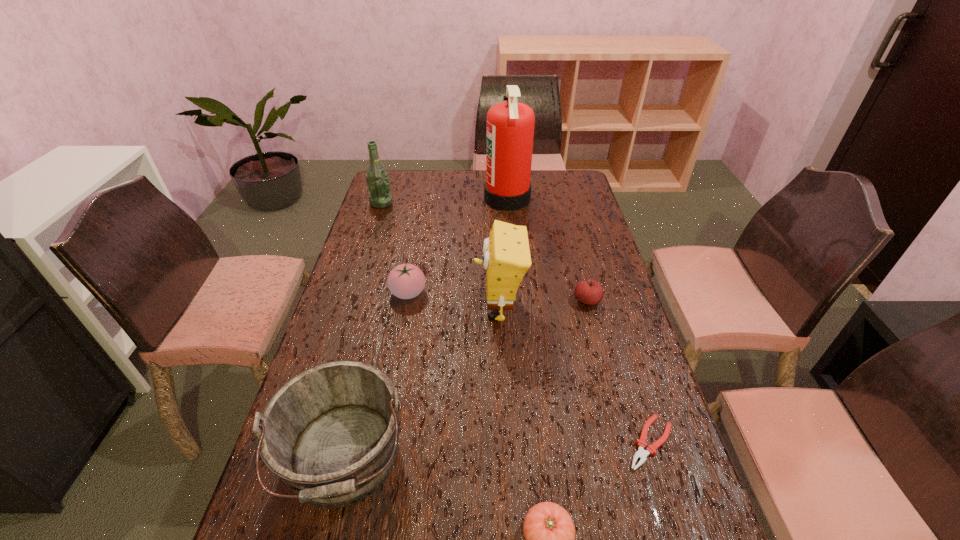
I want to click on beer bottle that is at the far edge, so click(378, 185).

Locate an element on the screen. beer bottle located at the left edge is located at coordinates (378, 185).

You are a GUI agent. You are given a task and a screenshot of the screen. Output one action in this format:
    pyautogui.click(x=<x>, y=<y>)
    Task: Click on the wine bucket at the left edge
    The width and height of the screenshot is (960, 540).
    Given the screenshot: What is the action you would take?
    pyautogui.click(x=330, y=433)

Locate an element on the screen. This screenshot has width=960, height=540. tomato at the left edge is located at coordinates (406, 281).

At what (x,y) coordinates should I click in order to perform the action: click on tomato that is at the right edge. Please return your answer as a coordinate pair (x, y). Looking at the image, I should click on (589, 292).

Find the location of a particular element. pliers situated at the right edge is located at coordinates (651, 449).

Identify the location of object present at the far left corner. The height and width of the screenshot is (540, 960). (378, 185).

In order to click on free point at the far edge in this screenshot , I will do `click(472, 171)`.

In the image, there is a desktop. At what (x,y) coordinates should I click in order to perform the action: click on vacant space at the left edge. Please return your answer as a coordinate pair (x, y). The width and height of the screenshot is (960, 540). Looking at the image, I should click on (353, 296).

The height and width of the screenshot is (540, 960). What are the coordinates of `vacant region at the right edge of the desktop` in the screenshot? It's located at (636, 507).